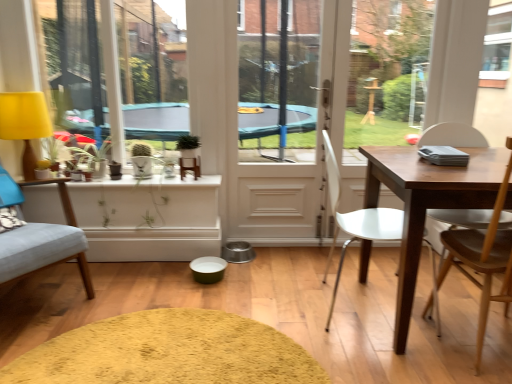
You are a GUI agent. You are given a task and a screenshot of the screen. Output one action in this format:
    pyautogui.click(x=<x>, y=<y>)
    Task: Click on the free space underneath light blue fabric chair at left, the 1th chair in the left-to-right sequence (from a real-world perspective)
    This screenshot has height=384, width=512.
    Given the screenshot: What is the action you would take?
    pyautogui.click(x=38, y=295)